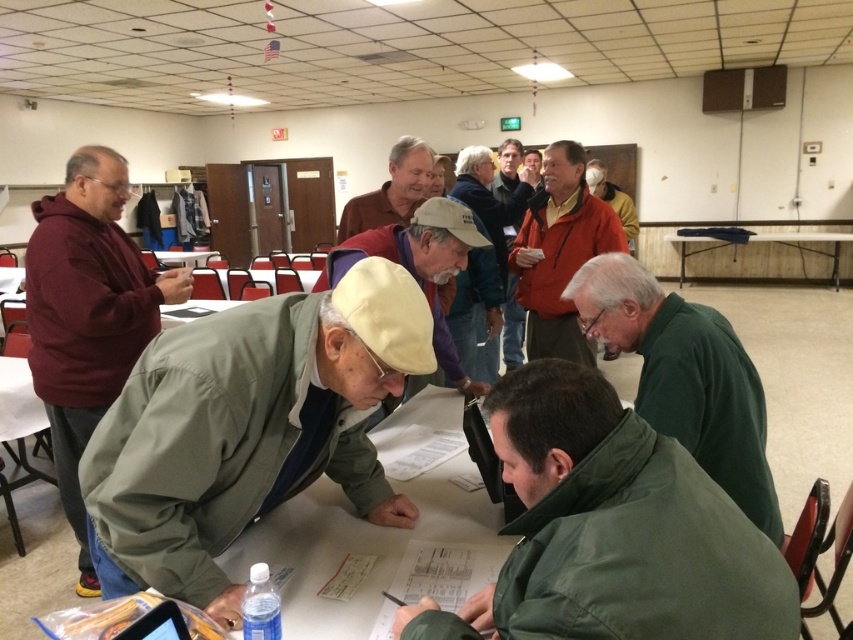
You are a photographer positioned at the back of the room. You need to take a photo that includes both the green matte jacket at lower center and the green matte jacket at lower right. Given the camera you have can capture a maximum width of 30 inches, will you be able to fit both jackets in the frame?

The distance between the green matte jacket at lower center and the green matte jacket at lower right is 28.12 inches, which is within the camera maximum width of 30 inches. Therefore, both jackets can be captured in a single frame.

You are standing in the room and want to take a photo of the point at coordinates (575, 557). Your camera has a focal length of 50mm and you are 81.90 centimeters away from the point. What is the required distance in millimeters between the camera lens and the image sensor to focus properly on the point?

The required distance is calculated using the lens formula 1 focal length equals 1 object distance plus 1 image distance. Plugging in the values, the image distance should be approximately 50.0 mm.

You are organizing a small event in this room and need to place a decorative banner between the maroon hoodie at left and the white plastic table at lower left. Which object should the banner be closer to if you want it to be proportionally balanced?

The banner should be closer to the white plastic table at lower left because the maroon hoodie at left is smaller in size compared to the white plastic table at lower left, so balancing the banner closer to the larger object would create a more proportionally balanced arrangement.